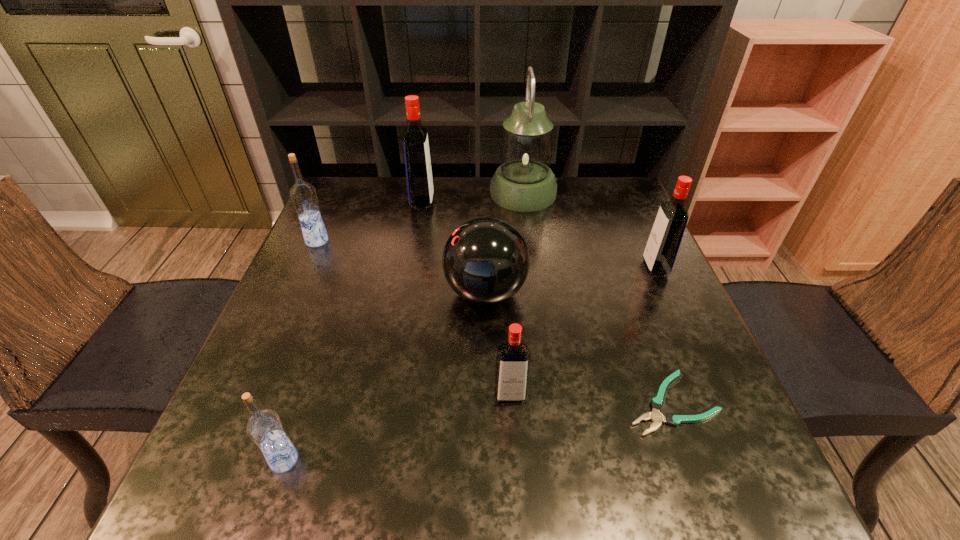
You are a GUI agent. You are given a task and a screenshot of the screen. Output one action in this format:
    pyautogui.click(x=<x>, y=<y>)
    Task: Click on the vacant space in between the bowling ball and the pliers
    The image size is (960, 540).
    Given the screenshot: What is the action you would take?
    pyautogui.click(x=578, y=348)

Where is `blank region between the second red vodka from left to right and the teal pliers`? This screenshot has height=540, width=960. blank region between the second red vodka from left to right and the teal pliers is located at coordinates (590, 399).

Where is `vacant point located between the right blue vodka and the third farthest object`? The image size is (960, 540). vacant point located between the right blue vodka and the third farthest object is located at coordinates (300, 350).

The width and height of the screenshot is (960, 540). What are the coordinates of `blank region between the shortest object and the greenish lantern` in the screenshot? It's located at (597, 298).

Where is `free space between the farthest vodka and the greenish lantern`? The width and height of the screenshot is (960, 540). free space between the farthest vodka and the greenish lantern is located at coordinates (472, 198).

Find the location of `free space between the bigger blue vodka and the teal pliers`. free space between the bigger blue vodka and the teal pliers is located at coordinates (494, 322).

Identify which object is the closest to the third vodka from left to right. Please provide its 2D coordinates. Your answer should be formatted as a tuple, i.e. [(x, y)], where the tuple contains the x and y coordinates of a point satisfying the conditions above.

[(524, 182)]

Locate which object ranks fifth in proximity to the lantern. Please provide its 2D coordinates. Your answer should be formatted as a tuple, i.e. [(x, y)], where the tuple contains the x and y coordinates of a point satisfying the conditions above.

[(657, 403)]

I want to click on vodka that stands as the second closest to the second nearest red vodka, so click(419, 179).

Identify which vodka is the closest to the seventh shortest object. Please provide its 2D coordinates. Your answer should be formatted as a tuple, i.e. [(x, y)], where the tuple contains the x and y coordinates of a point satisfying the conditions above.

[(303, 195)]